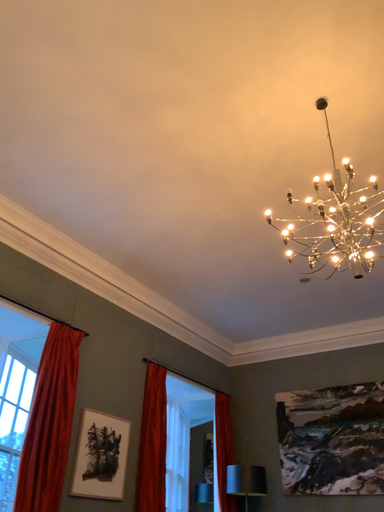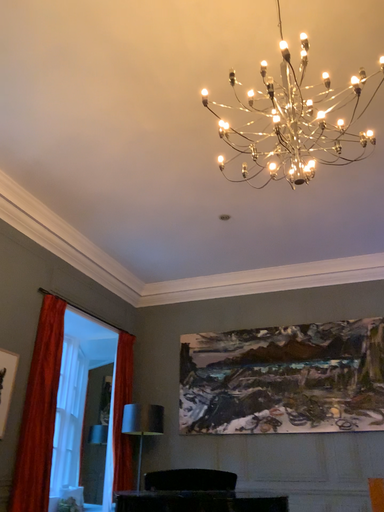
Question: Which way did the camera rotate in the video?

Choices:
 (A) rotated right
 (B) rotated left

Answer: (A)